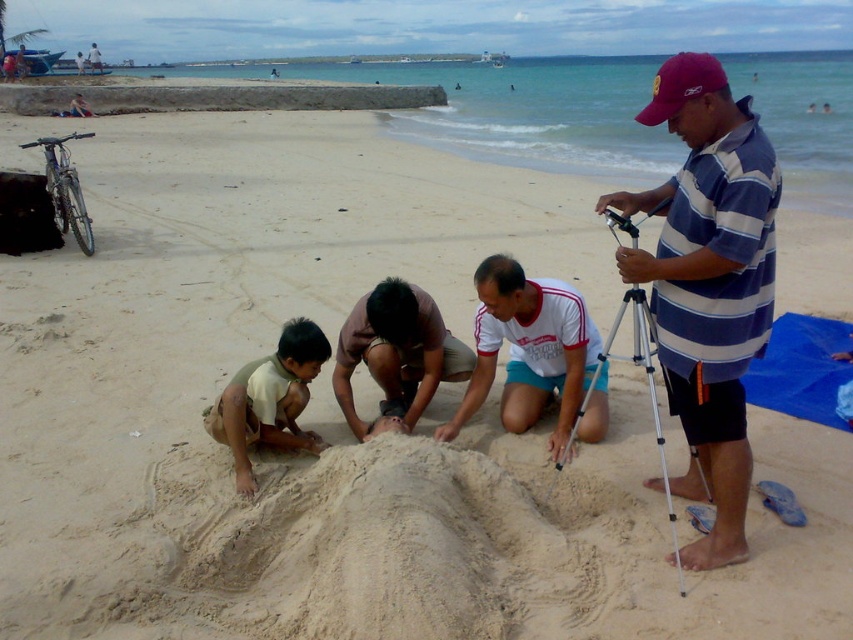
You are a photographer setting up a tripod on the beach. You have the silver metallic tripod at right and need to place it on the light brown sand at lower left. Considering the sand texture, will the tripod sink into the sand? Explain your answer using the sand and tripod details.

The light brown sand at lower left has a smaller size compared to the silver metallic tripod at right. Smaller sand grains can compact more easily, providing a firmer surface. Therefore, the tripod is less likely to sink into the sand.

In the scene shown: Where is the striped cotton shirt at center located in the image?

The striped cotton shirt at center is located at point 0.442 on the x axis and 0.831 on the y axis.